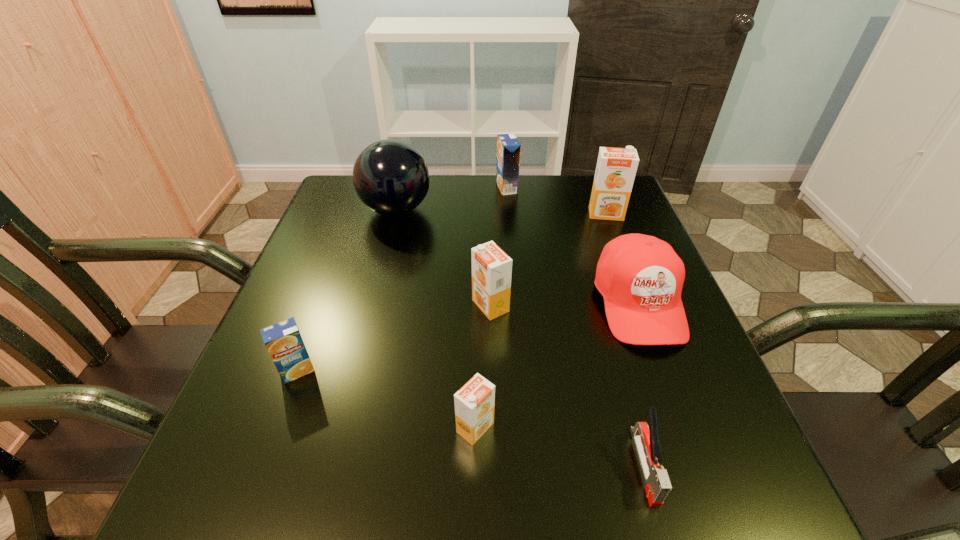
The height and width of the screenshot is (540, 960). I want to click on free point between the sixth farthest object and the rightmost orange orange juice, so click(x=451, y=292).

Locate an element on the screen. The width and height of the screenshot is (960, 540). vacant space that's between the fourth nearest orange juice and the nearest orange juice is located at coordinates (540, 321).

Where is `free spot between the second biggest orange orange juice and the smallest orange orange juice`? The height and width of the screenshot is (540, 960). free spot between the second biggest orange orange juice and the smallest orange orange juice is located at coordinates (483, 367).

You are a GUI agent. You are given a task and a screenshot of the screen. Output one action in this format:
    pyautogui.click(x=<x>, y=<y>)
    Task: Click on the free space between the bigger blue orange_juice and the black bowling ball
    This screenshot has width=960, height=540.
    Given the screenshot: What is the action you would take?
    pyautogui.click(x=451, y=199)

At what (x,y) coordinates should I click in order to perform the action: click on empty space that is in between the nearest orange orange juice and the nearer blue orange_juice. Please return your answer as a coordinate pair (x, y). This screenshot has height=540, width=960. Looking at the image, I should click on (386, 399).

Find the location of a particular element. The height and width of the screenshot is (540, 960). the closest object relative to the rightmost orange orange juice is located at coordinates (640, 277).

At what (x,y) coordinates should I click in order to perform the action: click on object that is the second nearest to the tallest orange juice. Please return your answer as a coordinate pair (x, y). Looking at the image, I should click on (508, 147).

Point out which orange juice is positioned as the fourth nearest to the rightmost orange juice. Please provide its 2D coordinates. Your answer should be formatted as a tuple, i.e. [(x, y)], where the tuple contains the x and y coordinates of a point satisfying the conditions above.

[(283, 341)]

Locate an element on the screen. the second closest orange juice to the third farthest orange juice is located at coordinates (283, 341).

Identify which orange orange juice is the second nearest to the baseball cap. Please provide its 2D coordinates. Your answer should be formatted as a tuple, i.e. [(x, y)], where the tuple contains the x and y coordinates of a point satisfying the conditions above.

[(491, 267)]